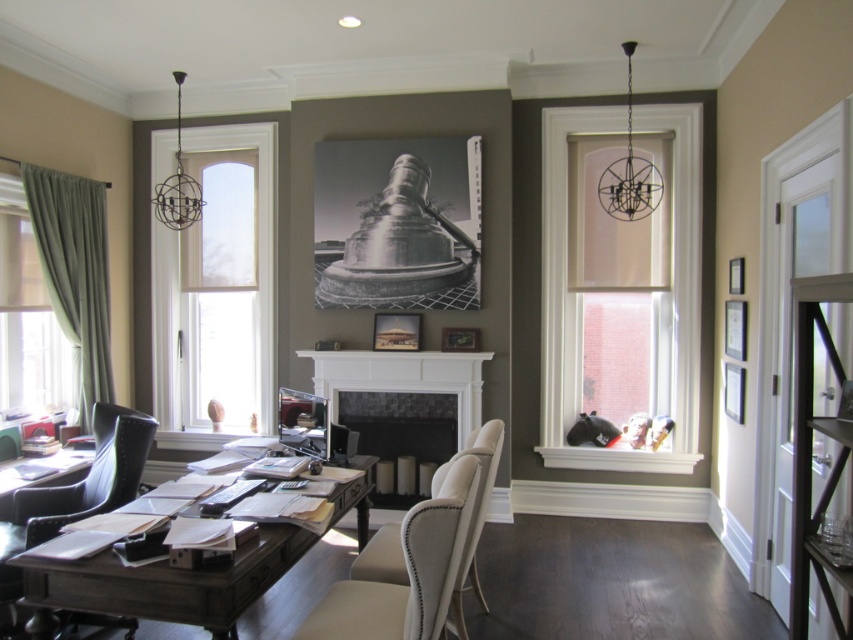
The image size is (853, 640). Describe the element at coordinates (403, 378) in the screenshot. I see `white marble fireplace at center` at that location.

Who is more forward, (344, 365) or (469, 589)?

Positioned in front is point (469, 589).

In order to click on white marble fireplace at center in this screenshot , I will do `click(403, 378)`.

How distant is green velvet curtain at left from black leather chair at lower left?

1.43 meters

Is green velvet curtain at left above black leather chair at lower left?

Indeed, green velvet curtain at left is positioned over black leather chair at lower left.

What are the coordinates of `green velvet curtain at left` in the screenshot? It's located at (74, 273).

This screenshot has height=640, width=853. What are the coordinates of `green velvet curtain at left` in the screenshot? It's located at (74, 273).

Consider the image. Does white matte window at upper right appear over beige fabric chair at center?

Yes.

Which is below, white matte window at upper right or beige fabric chair at center?

beige fabric chair at center

Who is more distant from viewer, (682, 342) or (461, 637)?

The point (682, 342) is behind.

Image resolution: width=853 pixels, height=640 pixels. Find the location of `white matte window at upper right`. white matte window at upper right is located at coordinates (577, 300).